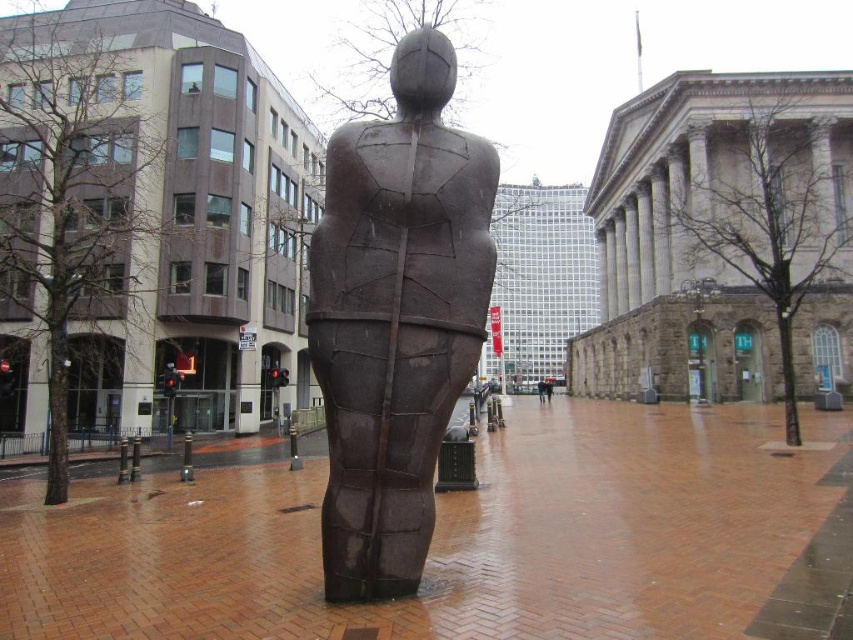
Is bronze textured sculpture at center bigger than brown matte statue at center?

Incorrect, bronze textured sculpture at center is not larger than brown matte statue at center.

Who is lower down, bronze textured sculpture at center or brown matte statue at center?

brown matte statue at center

Between point (439, 269) and point (550, 381), which one is positioned behind?

The point (550, 381) is behind.

At what (x,y) coordinates should I click in order to perform the action: click on bronze textured sculpture at center. Please return your answer as a coordinate pair (x, y). This screenshot has height=640, width=853. Looking at the image, I should click on (396, 317).

From the picture: Does dark brown statue at center have a lesser height compared to brown matte statue at center?

No.

Is point (538, 390) behind point (550, 400)?

Yes, point (538, 390) is farther from viewer.

Find the location of `dark brown statue at center`. dark brown statue at center is located at coordinates (541, 388).

Is point (341, 600) positioned after point (540, 385)?

No.

Is bronze textured sculpture at center above dark brown statue at center?

Yes.

The height and width of the screenshot is (640, 853). Describe the element at coordinates (396, 317) in the screenshot. I see `bronze textured sculpture at center` at that location.

This screenshot has height=640, width=853. Identify the location of bronze textured sculpture at center. (396, 317).